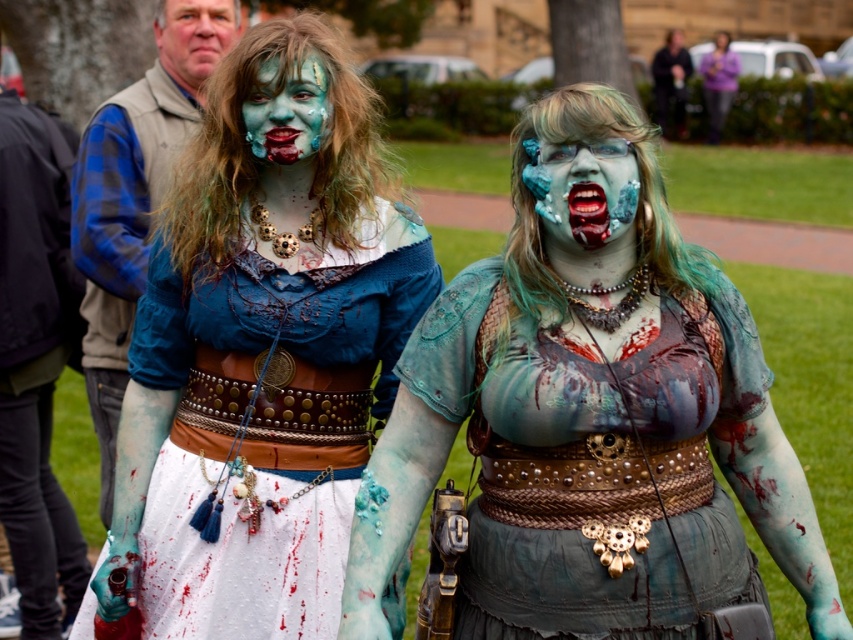
Is matte blue fabric dress at center smaller than matte skin face at upper left?

No.

Where is `matte blue fabric dress at center`? matte blue fabric dress at center is located at coordinates (259, 365).

Which is in front, point (161, 273) or point (202, 70)?

Point (161, 273) is in front.

You are a GUI agent. You are given a task and a screenshot of the screen. Output one action in this format:
    pyautogui.click(x=<x>, y=<y>)
    Task: Click on the matte blue fabric dress at center
    This screenshot has width=853, height=640.
    Given the screenshot: What is the action you would take?
    pos(259,365)

Between point (50, 604) and point (711, 83), which one is positioned behind?

Positioned behind is point (711, 83).

The height and width of the screenshot is (640, 853). What do you see at coordinates (35, 364) in the screenshot?
I see `matte leather belt at center` at bounding box center [35, 364].

Locate an element on the screen. The height and width of the screenshot is (640, 853). matte leather belt at center is located at coordinates (35, 364).

Who is shorter, matte blue fabric dress at center or matte blue-green dress at center?

Standing shorter between the two is matte blue-green dress at center.

Between matte blue fabric dress at center and matte blue-green dress at center, which one appears on the right side from the viewer's perspective?

matte blue-green dress at center is more to the right.

Which is in front, point (252, 188) or point (521, 321)?

Point (521, 321) is more forward.

In order to click on matte blue fabric dress at center in this screenshot , I will do `click(259, 365)`.